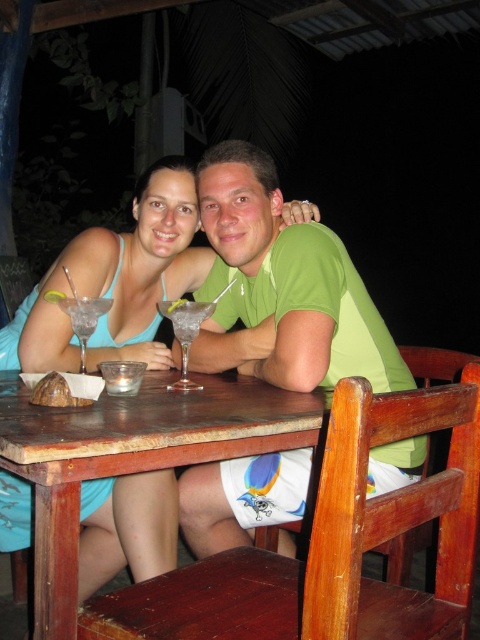
You are a photographer trying to capture the best shot of the two points in the scene. Which point, point (338, 276) or point (91, 316), is closer to the camera?

Point (338, 276) is further to the camera than point (91, 316), so the closer point to the camera is point (91, 316).

You are a server at the beachside restaurant and need to place a new drink order on the wooden table at center. The drink is taller than the clear glass martini at table left. Will the drink fit on the table?

The wooden table at center is much taller than the clear glass martini at table left, so the drink, which is taller than the martini, will fit on the table.